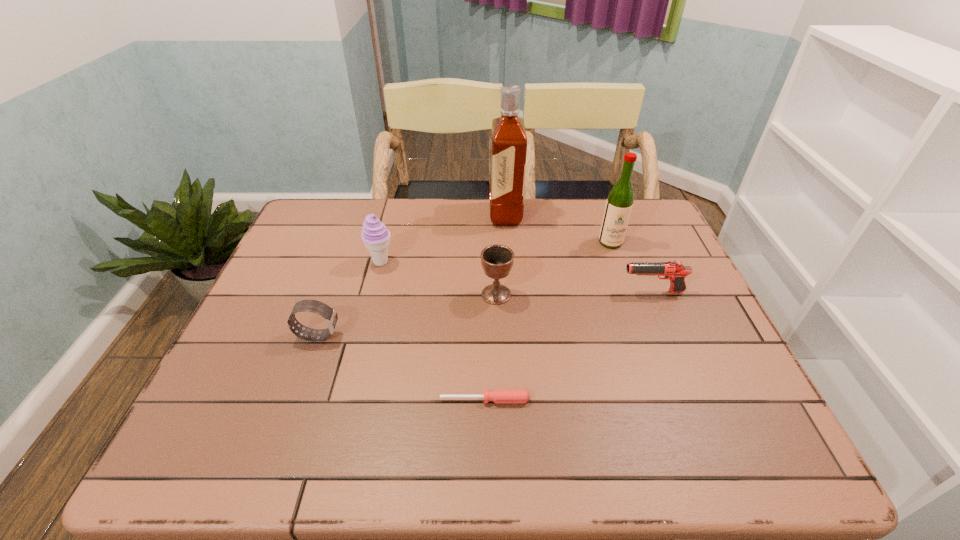
The height and width of the screenshot is (540, 960). I want to click on the shortest object, so click(x=498, y=395).

The width and height of the screenshot is (960, 540). In order to click on the nearest object in this screenshot , I will do `click(498, 395)`.

The height and width of the screenshot is (540, 960). Find the location of `free spot located on the front label of the farthest object`. free spot located on the front label of the farthest object is located at coordinates (462, 214).

Where is `vacant space located 0.150m on the front label of the farthest object`? The width and height of the screenshot is (960, 540). vacant space located 0.150m on the front label of the farthest object is located at coordinates (444, 214).

This screenshot has width=960, height=540. I want to click on free region located on the front label of the farthest object, so click(x=400, y=214).

You are a GUI agent. You are given a task and a screenshot of the screen. Output one action in this format:
    pyautogui.click(x=<x>, y=<y>)
    Task: Click on the vacant space positioned on the label of the second tallest object
    Image resolution: width=960 pixels, height=540 pixels.
    Given the screenshot: What is the action you would take?
    pyautogui.click(x=647, y=346)

Locate an element on the screen. Image resolution: width=960 pixels, height=540 pixels. free space located 0.150m on the front of the fifth nearest object is located at coordinates pyautogui.click(x=369, y=311).

The image size is (960, 540). What are the coordinates of `vacant space located 0.090m on the front of the chalice` in the screenshot? It's located at (497, 333).

Find the location of `free space located 0.340m on the face of the second nearest object`. free space located 0.340m on the face of the second nearest object is located at coordinates (483, 335).

What are the coordinates of `blank space located at the aiming end of the gun` in the screenshot? It's located at (469, 292).